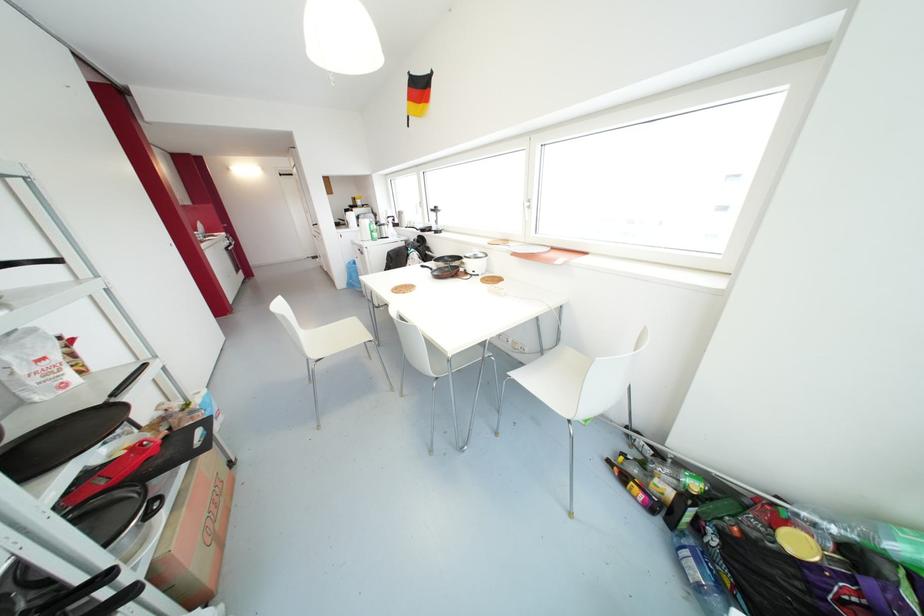
Find the location of a particular element. The width and height of the screenshot is (924, 616). green plastic bottle is located at coordinates (720, 508).